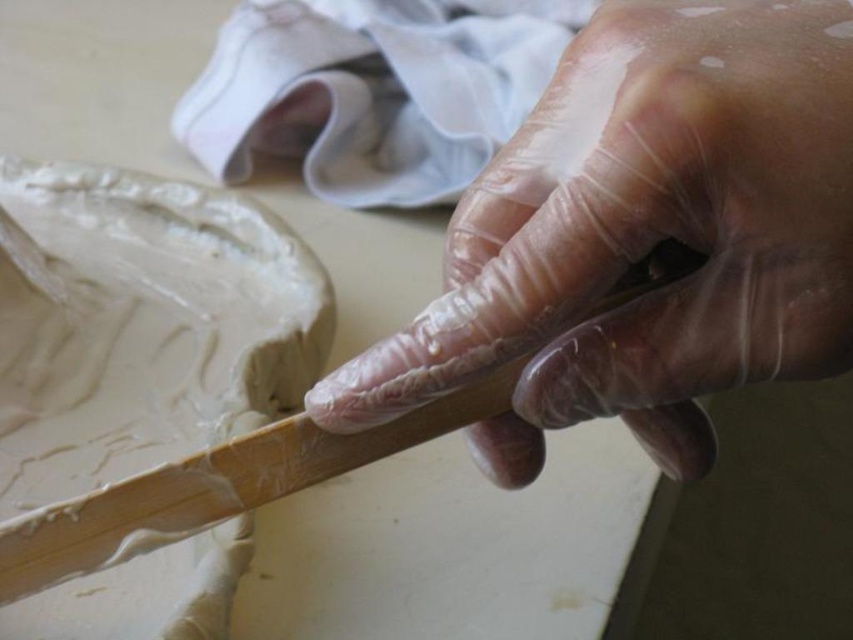
Is transparent plastic hand at center further to camera compared to white clay at upper left?

No, transparent plastic hand at center is closer to the viewer.

Can you confirm if transparent plastic hand at center is positioned to the left of white clay at upper left?

Incorrect, transparent plastic hand at center is not on the left side of white clay at upper left.

Between point (828, 81) and point (74, 236), which one is positioned behind?

The point (74, 236) is behind.

Where is `transparent plastic hand at center`? transparent plastic hand at center is located at coordinates (643, 236).